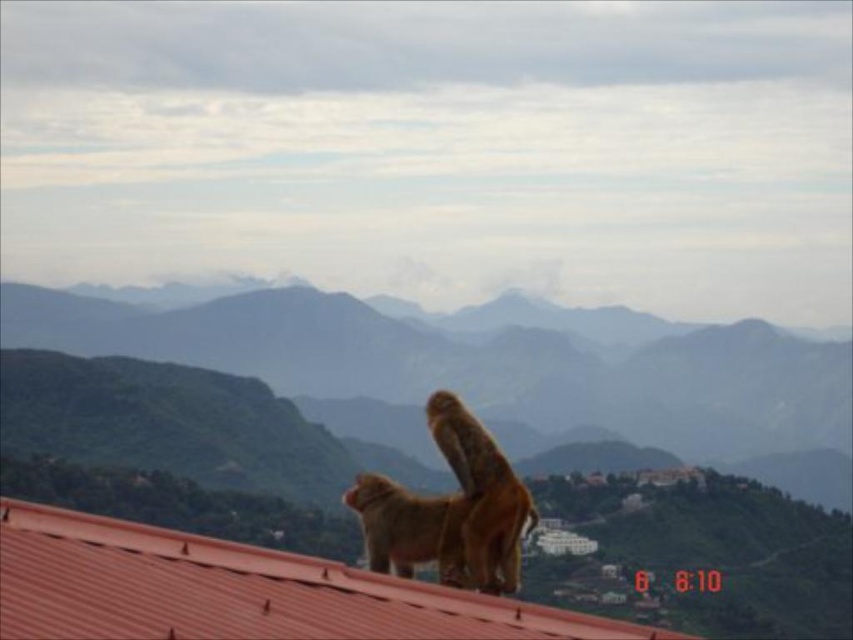
Between green textured mountain at upper center and metallic red roof at center, which one has more height?

With more height is green textured mountain at upper center.

How far apart are green textured mountain at upper center and metallic red roof at center?

They are 63.07 meters apart.

Which is in front, point (808, 512) or point (90, 621)?

Point (90, 621) is more forward.

Locate an element on the screen. green textured mountain at upper center is located at coordinates (431, 440).